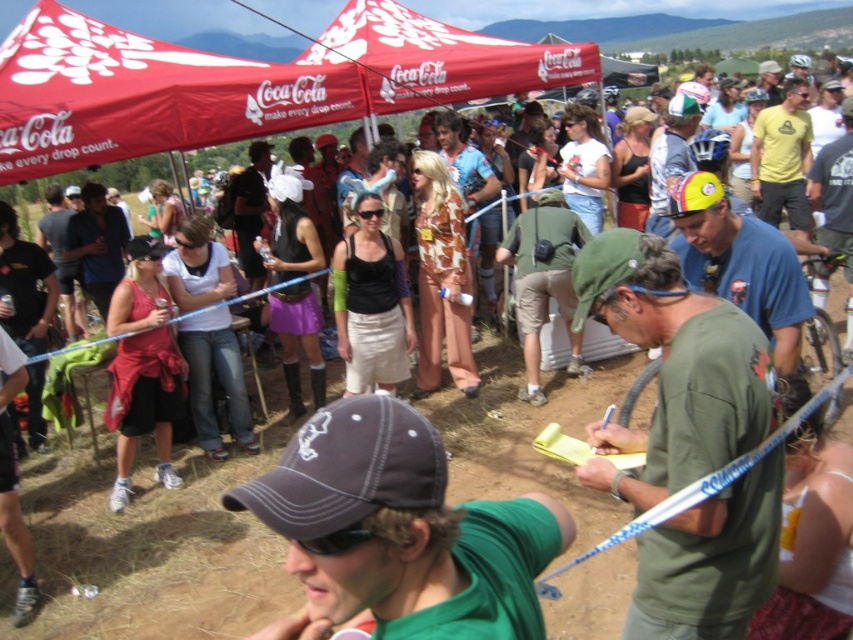
You are a participant in the race and need to locate the red fabric canopy at upper center and the green matte shirt at center. Which object is closer to the ground?

The red fabric canopy at upper center is closer to the ground because it has a lesser height compared to the green matte shirt at center.

Consider the image. You are a participant in the race and you need to decide which object is wider. You see the red fabric canopy at upper center and the green matte shirt at center. Which one is wider?

The red fabric canopy at upper center has a lesser width compared to green matte shirt at center, so the green matte shirt at center is wider.